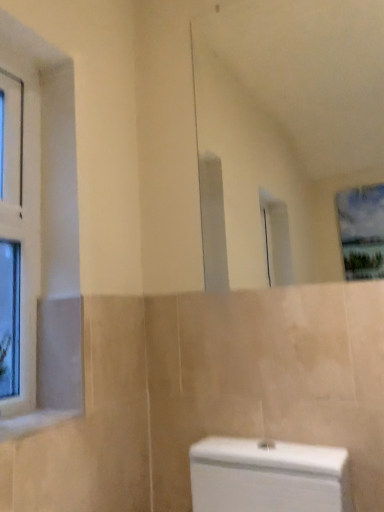
The image size is (384, 512). What do you see at coordinates (290, 121) in the screenshot?
I see `white glossy mirror at upper center` at bounding box center [290, 121].

What do you see at coordinates (33, 422) in the screenshot? This screenshot has height=512, width=384. I see `white marble window sill at lower left` at bounding box center [33, 422].

This screenshot has width=384, height=512. Find the location of `white glossy mirror at upper center`. white glossy mirror at upper center is located at coordinates (290, 121).

From the image's perspective, is clear glass window at left on top of white glossy mirror at upper center?

Incorrect, from the image's perspective, clear glass window at left is lower than white glossy mirror at upper center.

Is clear glass window at left next to white glossy mirror at upper center and touching it?

They are not placed beside each other.

Which object is further away from the camera, clear glass window at left or white glossy mirror at upper center?

clear glass window at left.

Considering the positions of objects clear glass window at left and white glossy mirror at upper center in the image provided, who is more to the right, clear glass window at left or white glossy mirror at upper center?

Positioned to the right is white glossy mirror at upper center.

How different are the orientations of white marble window sill at lower left and clear glass window at left in degrees?

The angular difference between white marble window sill at lower left and clear glass window at left is 7.31e-05 degrees.

Is the depth of white marble window sill at lower left less than that of clear glass window at left?

Yes, the depth of white marble window sill at lower left is less than that of clear glass window at left.

Is point (22, 415) closer to viewer compared to point (36, 172)?

That is True.

Considering the sizes of objects clear glass window at left and white marble window sill at lower left in the image provided, who is smaller, clear glass window at left or white marble window sill at lower left?

Smaller between the two is white marble window sill at lower left.

Is clear glass window at left positioned in front of white marble window sill at lower left?

No, the depth of clear glass window at left is greater than that of white marble window sill at lower left.

Based on the photo, is clear glass window at left far away from white marble window sill at lower left?

Actually, clear glass window at left and white marble window sill at lower left are a little close together.

Does point (8, 101) appear closer or farther from the camera than point (10, 439)?

Point (8, 101).

From the image's perspective, which one is positioned lower, white marble window sill at lower left or white glossy mirror at upper center?

white marble window sill at lower left, from the image's perspective.

Based on the photo, is white marble window sill at lower left taller than white glossy mirror at upper center?

No, white marble window sill at lower left is not taller than white glossy mirror at upper center.

Does point (7, 433) come behind point (245, 283)?

No, it is not.

Looking at this image, which object is positioned more to the right, white glossy mirror at upper center or clear glass window at left?

white glossy mirror at upper center.

From a real-world perspective, relative to clear glass window at left, is white glossy mirror at upper center vertically above or below?

Clearly, from a real-world perspective, white glossy mirror at upper center is above clear glass window at left.

Considering the positions of objects white glossy mirror at upper center and clear glass window at left in the image provided, who is behind, white glossy mirror at upper center or clear glass window at left?

clear glass window at left is behind.

Considering the sizes of objects white glossy mirror at upper center and clear glass window at left in the image provided, who is bigger, white glossy mirror at upper center or clear glass window at left?

white glossy mirror at upper center.

Who is bigger, white glossy mirror at upper center or white marble window sill at lower left?

With larger size is white glossy mirror at upper center.

Looking at this image, can you confirm if white glossy mirror at upper center is taller than white marble window sill at lower left?

Indeed, white glossy mirror at upper center has a greater height compared to white marble window sill at lower left.

Is the surface of white glossy mirror at upper center in direct contact with white marble window sill at lower left?

There is a gap between white glossy mirror at upper center and white marble window sill at lower left.

At what (x,y) coordinates should I click in order to perform the action: click on mirror above the clear glass window at left (from the image's perspective). Please return your answer as a coordinate pair (x, y). Looking at the image, I should click on (290, 121).

In order to click on window sill that appears on the right of clear glass window at left in this screenshot , I will do `click(33, 422)`.

When comparing their distances from white marble window sill at lower left, does clear glass window at left or white glossy mirror at upper center seem closer?

clear glass window at left.

Considering their positions, is white marble window sill at lower left positioned closer to white glossy mirror at upper center than clear glass window at left?

clear glass window at left.

When comparing their distances from white glossy mirror at upper center, does clear glass window at left or white marble window sill at lower left seem further?

white marble window sill at lower left.

Which object lies nearer to the anchor point clear glass window at left, white marble window sill at lower left or white glossy mirror at upper center?

white marble window sill at lower left.

Considering their positions, is white glossy mirror at upper center positioned further to clear glass window at left than white marble window sill at lower left?

white glossy mirror at upper center is positioned further to the anchor clear glass window at left.

Based on their spatial positions, is white glossy mirror at upper center or clear glass window at left further from white marble window sill at lower left?

Based on the image, white glossy mirror at upper center appears to be further to white marble window sill at lower left.

Locate an element on the screen. This screenshot has height=512, width=384. window sill between clear glass window at left and white glossy mirror at upper center from left to right is located at coordinates (33, 422).